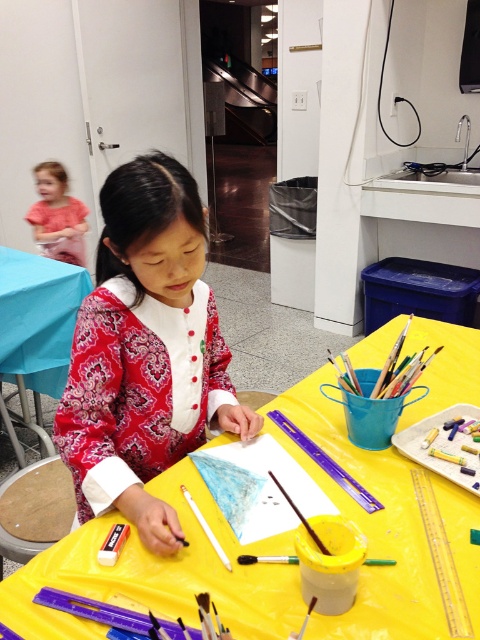
Question: Does matte blue table at center lie in front of matte pink shirt at upper left?

Choices:
 (A) yes
 (B) no

Answer: (A)

Question: Which of the following is the farthest from the observer?

Choices:
 (A) (34, 269)
 (B) (457, 364)

Answer: (A)

Question: Considering the real-world distances, which object is farthest from the matte blue table at center?

Choices:
 (A) matte pink shirt at upper left
 (B) yellow plastic table at center
 (C) matte red dress at center

Answer: (B)

Question: Can you confirm if yellow plastic table at center is thinner than matte red dress at center?

Choices:
 (A) no
 (B) yes

Answer: (A)

Question: Is yellow plastic table at center below matte red dress at center?

Choices:
 (A) yes
 (B) no

Answer: (A)

Question: Which object is farther from the camera taking this photo?

Choices:
 (A) matte blue table at center
 (B) matte pink shirt at upper left

Answer: (B)